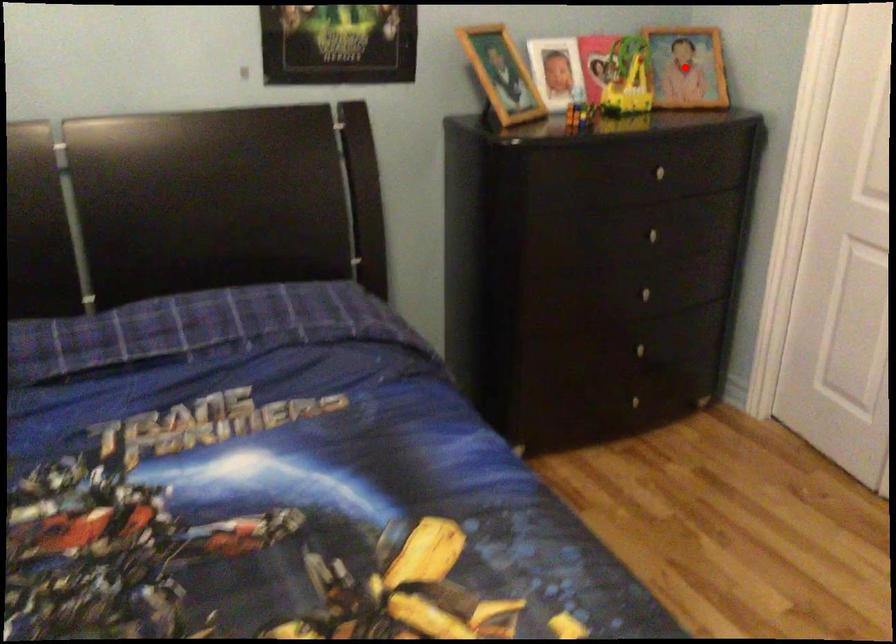
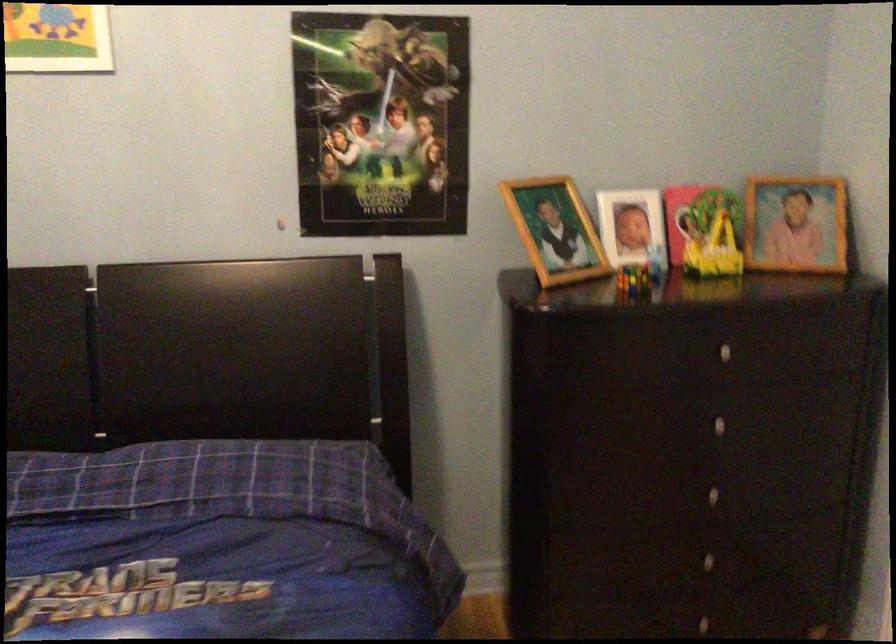
Question: I am providing you with two images of the same scene from different viewpoints. In image1, a red point is highlighted. Considering the same 3D point in image2, which of the following is correct?

Choices:
 (A) It is closer
 (B) It is farther

Answer: (A)